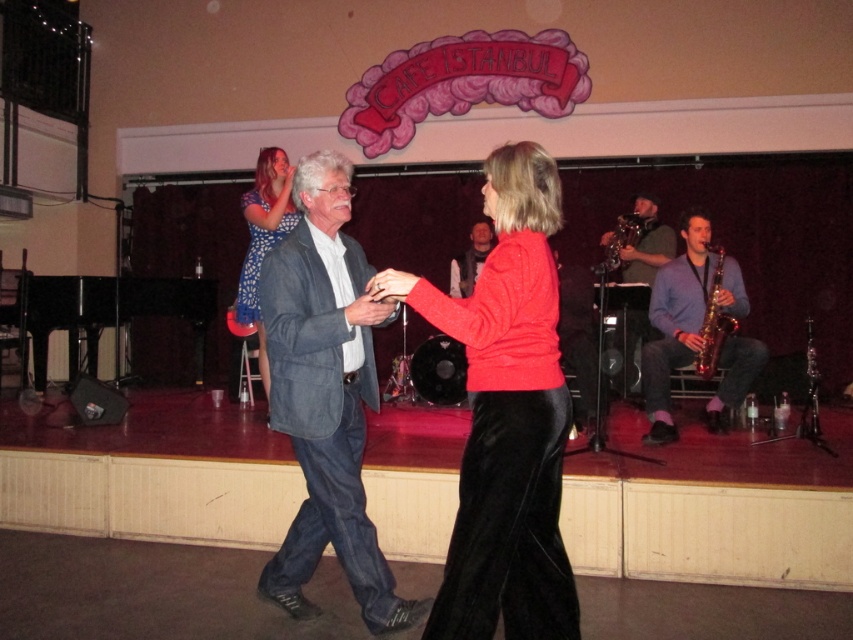
Is shiny silver saxophone at right positioned before matte gray suit at center?

Yes, it is.

Is shiny silver saxophone at right wider than matte gray suit at center?

Correct, the width of shiny silver saxophone at right exceeds that of matte gray suit at center.

Which is behind, point (654, 228) or point (469, 266)?

The point (654, 228) is more distant.

Locate an element on the screen. The image size is (853, 640). shiny silver saxophone at right is located at coordinates (646, 243).

This screenshot has height=640, width=853. Describe the element at coordinates (676, 321) in the screenshot. I see `blue sweater at right` at that location.

Can you confirm if blue sweater at right is positioned above blue dotted dress at upper left?

No.

Which is behind, point (700, 252) or point (276, 195)?

Positioned behind is point (700, 252).

Locate an element on the screen. The height and width of the screenshot is (640, 853). blue sweater at right is located at coordinates (676, 321).

In the scene shown: Is shiny silver saxophone at right to the right of shiny gold saxophone at right from the viewer's perspective?

No, shiny silver saxophone at right is not to the right of shiny gold saxophone at right.

Is shiny silver saxophone at right behind shiny gold saxophone at right?

Yes, it is.

Describe the element at coordinates (646, 243) in the screenshot. I see `shiny silver saxophone at right` at that location.

The width and height of the screenshot is (853, 640). I want to click on shiny silver saxophone at right, so click(x=646, y=243).